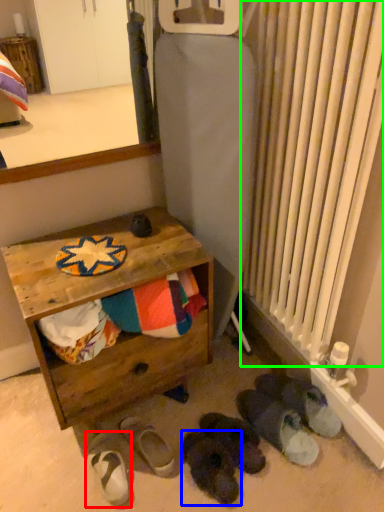
Question: Considering the real-world distances, which object is farthest from footwear (highlighted by a red box)? footwear (highlighted by a blue box) or radiator (highlighted by a green box)?

Choices:
 (A) footwear
 (B) radiator

Answer: (B)